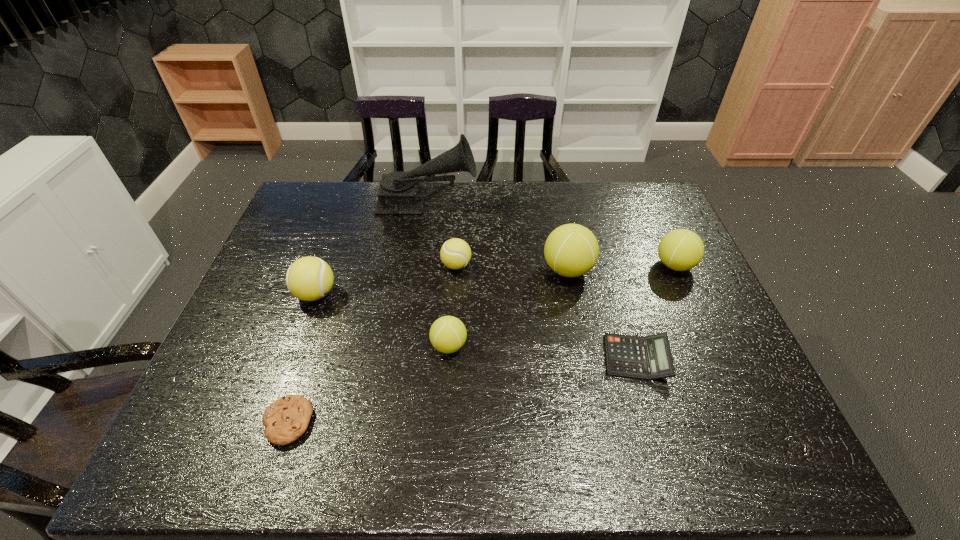
Where is `the farthest object`? the farthest object is located at coordinates (400, 192).

You are a GUI agent. You are given a task and a screenshot of the screen. Output one action in this format:
    pyautogui.click(x=<x>, y=<y>)
    Task: Click on the phonograph_record
    The image size is (960, 540).
    Given the screenshot: What is the action you would take?
    pyautogui.click(x=400, y=192)

At what (x,y) coordinates should I click in order to perform the action: click on the biggest green tennis ball. Please return your answer as a coordinate pair (x, y). Looking at the image, I should click on (571, 250).

Identify the location of the second tallest object. (571, 250).

The width and height of the screenshot is (960, 540). Find the location of `the left yellow tennis ball`. the left yellow tennis ball is located at coordinates (309, 278).

This screenshot has height=540, width=960. Find the location of `the nearer yellow tennis ball`. the nearer yellow tennis ball is located at coordinates (309, 278).

Find the location of a particular element. The width and height of the screenshot is (960, 540). the rightmost tennis ball is located at coordinates (680, 250).

Identify the location of the rightmost object. The height and width of the screenshot is (540, 960). (680, 250).

What are the coordinates of `the farther yellow tennis ball` in the screenshot? It's located at (455, 253).

Identify the location of the smaller yellow tennis ball. This screenshot has width=960, height=540. (455, 253).